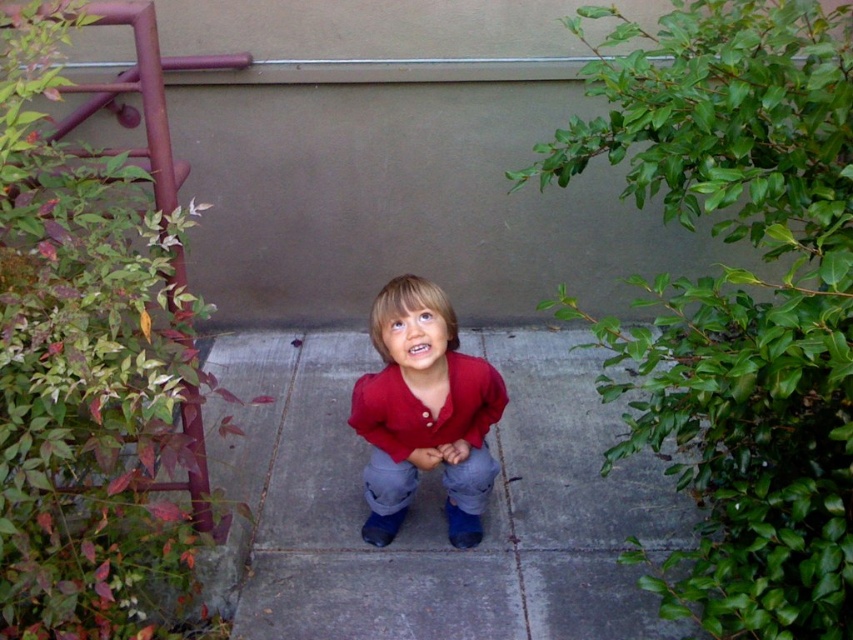
Is matte red shirt at center taller than denim jeans at center?

Yes, matte red shirt at center is taller than denim jeans at center.

The height and width of the screenshot is (640, 853). What are the coordinates of `matte red shirt at center` in the screenshot? It's located at coord(424,412).

At what (x,y) coordinates should I click in order to perform the action: click on matte red shirt at center. Please return your answer as a coordinate pair (x, y). Looking at the image, I should click on (424, 412).

This screenshot has width=853, height=640. What do you see at coordinates (439, 502) in the screenshot? I see `gray concrete pavement at center` at bounding box center [439, 502].

Who is more distant from viewer, (520, 470) or (419, 314)?

The point (520, 470) is more distant.

Describe the element at coordinates (439, 502) in the screenshot. I see `gray concrete pavement at center` at that location.

Image resolution: width=853 pixels, height=640 pixels. Find the location of `gray concrete pavement at center`. gray concrete pavement at center is located at coordinates (439, 502).

Is gray concrete pavement at center wider than denim jeans at center?

Yes, gray concrete pavement at center is wider than denim jeans at center.

Locate an element on the screen. The width and height of the screenshot is (853, 640). gray concrete pavement at center is located at coordinates (439, 502).